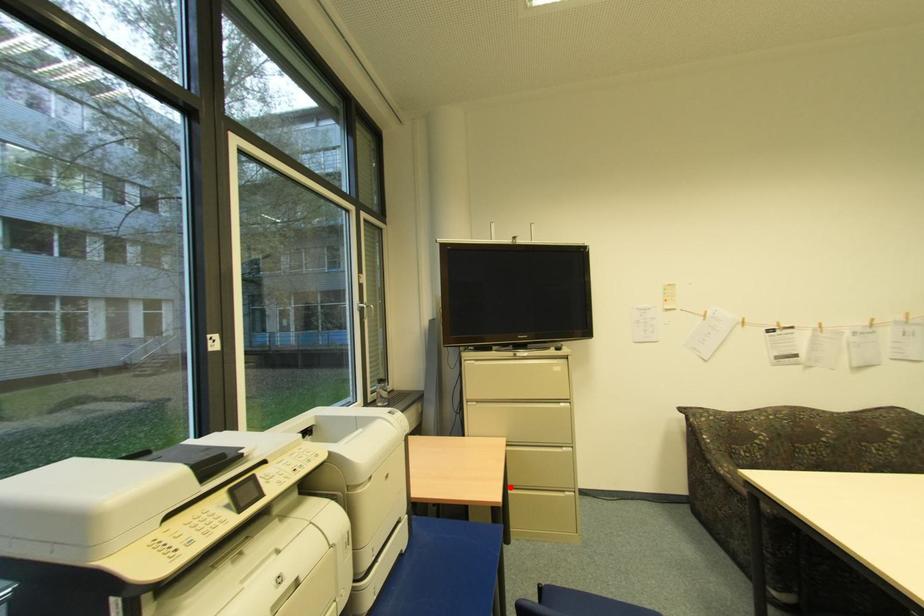
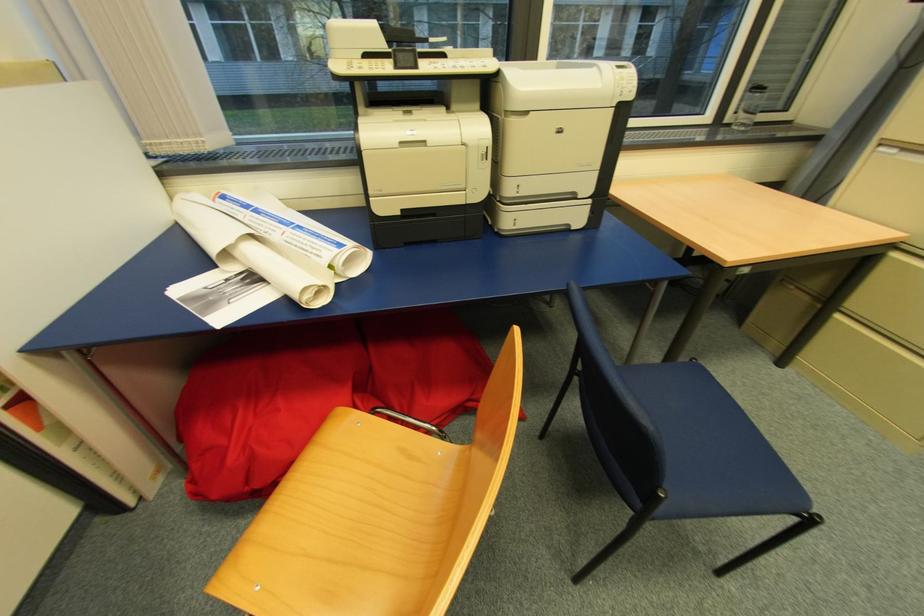
Question: I am providing you with two images of the same scene from different viewpoints. A red point is shown in image1. For the corresponding object point in image2, is it positioned nearer or farther from the camera?

Choices:
 (A) Nearer
 (B) Farther

Answer: (A)